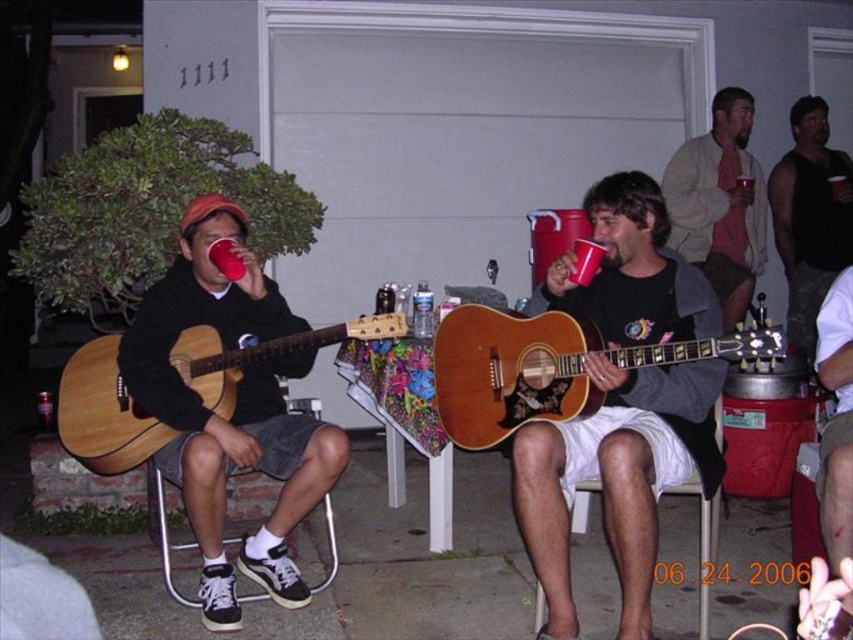
Question: Which of the following is the closest to the observer?

Choices:
 (A) (248, 360)
 (B) (223, 588)
 (C) (717, 161)
 (D) (741, 186)

Answer: (B)

Question: Which point is farther to the camera?

Choices:
 (A) (654, 180)
 (B) (740, 192)
 (C) (224, 403)

Answer: (B)

Question: Does camouflage shorts at center appear under white fabric chair at lower center?

Choices:
 (A) yes
 (B) no

Answer: (B)

Question: Can you confirm if natural wood acoustic guitar at left is smaller than light beige sweater at upper right?

Choices:
 (A) no
 (B) yes

Answer: (B)

Question: Is the position of matte brown guitar at center more distant than that of light beige sweater at upper right?

Choices:
 (A) yes
 (B) no

Answer: (B)

Question: Which object is the closest to the matte black guitar at left?

Choices:
 (A) natural wood acoustic guitar at left
 (B) white fabric chair at lower center
 (C) light beige sweater at upper right
 (D) matte brown guitar at center

Answer: (A)